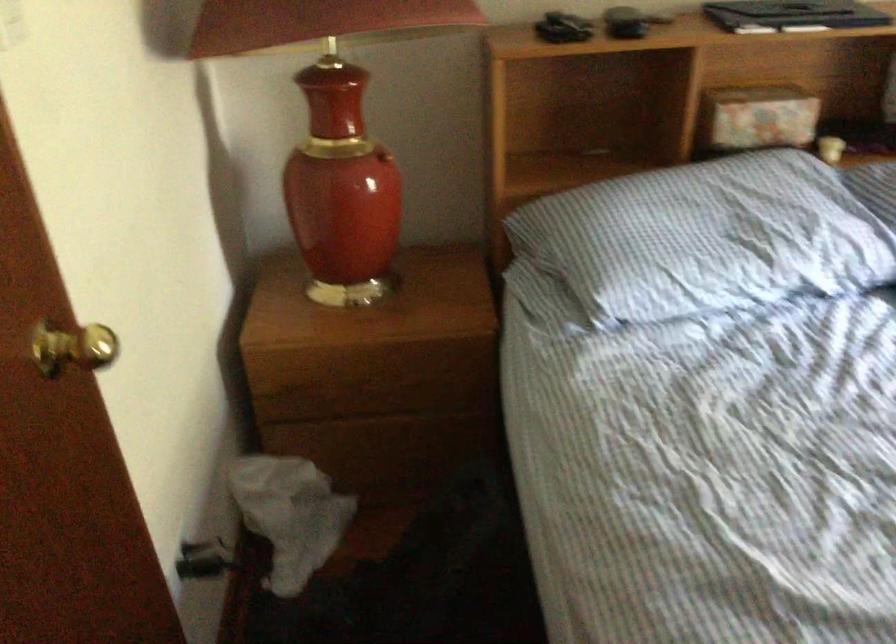
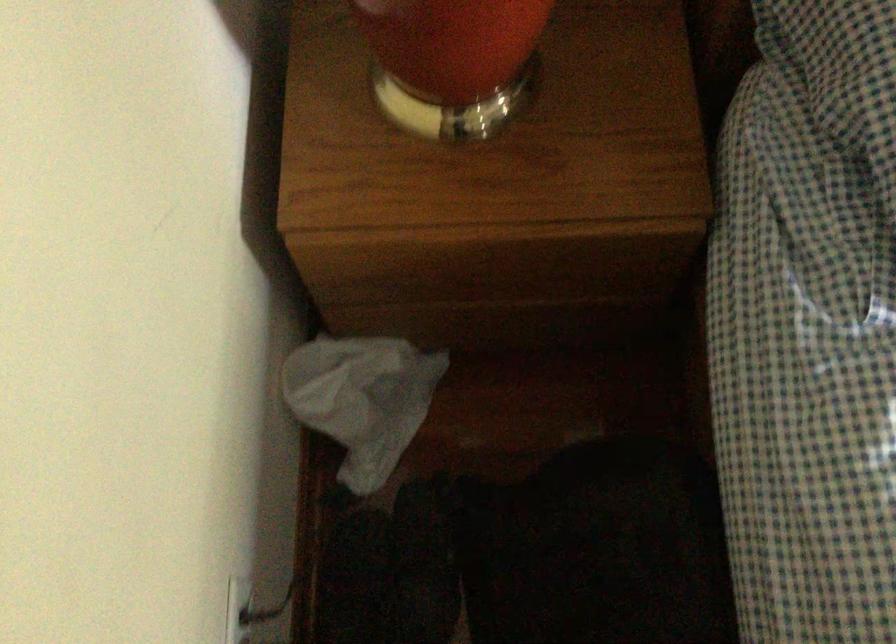
Question: The images are taken continuously from a first-person perspective. In which direction is your viewpoint rotating?

Choices:
 (A) Left
 (B) Right
 (C) Up
 (D) Down

Answer: (D)